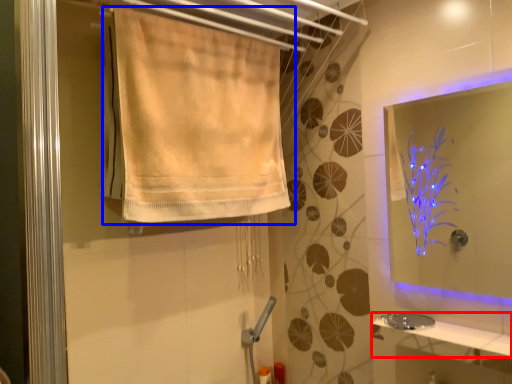
Question: Which object appears farthest to the camera in this image, counter top (highlighted by a red box) or curtain (highlighted by a blue box)?

Choices:
 (A) counter top
 (B) curtain

Answer: (B)